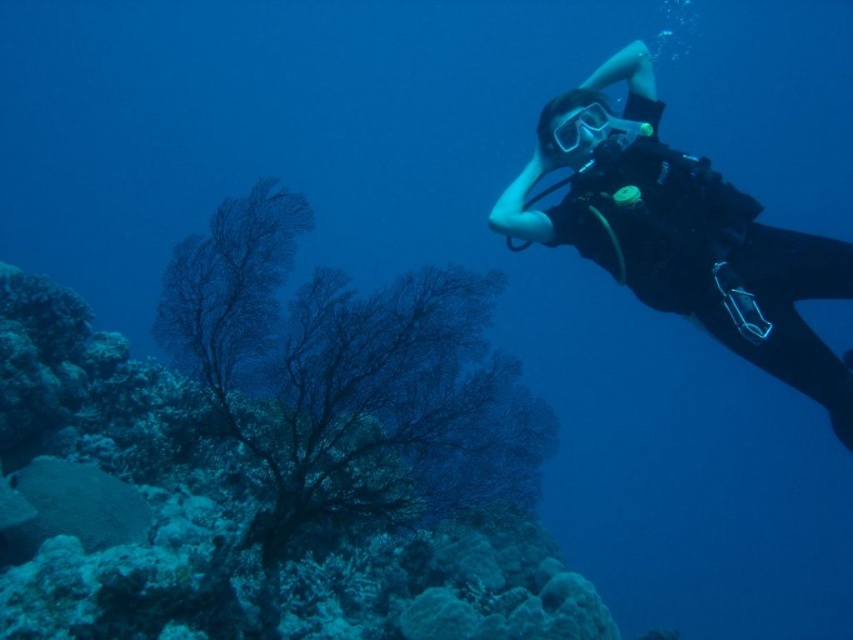
You are a marine biologist observing an underwater scene. You notice the black matte scuba diver at right and the transparent rubber goggles at upper right. Which object is positioned closer to you?

The black matte scuba diver at right is closer to the viewer than the transparent rubber goggles at upper right.

You are an underwater photographer aiming to capture a clear shot of the black matte scuba diver at right and the transparent rubber goggles at upper right. Considering their sizes, which object should you focus on first to ensure it fits entirely within your camera frame?

The transparent rubber goggles at upper right are smaller than the black matte scuba diver at right, so you should focus on capturing the transparent rubber goggles at upper right first to ensure it fits within the frame before adjusting for the larger diver.

You are a marine biologist observing the underwater scene. You need to determine which object is bigger between the dark green coral at lower left and the transparent rubber goggles at upper right. Can you identify the larger one?

The dark green coral at lower left is larger compared to the transparent rubber goggles at upper right, so the dark green coral at lower left is bigger.